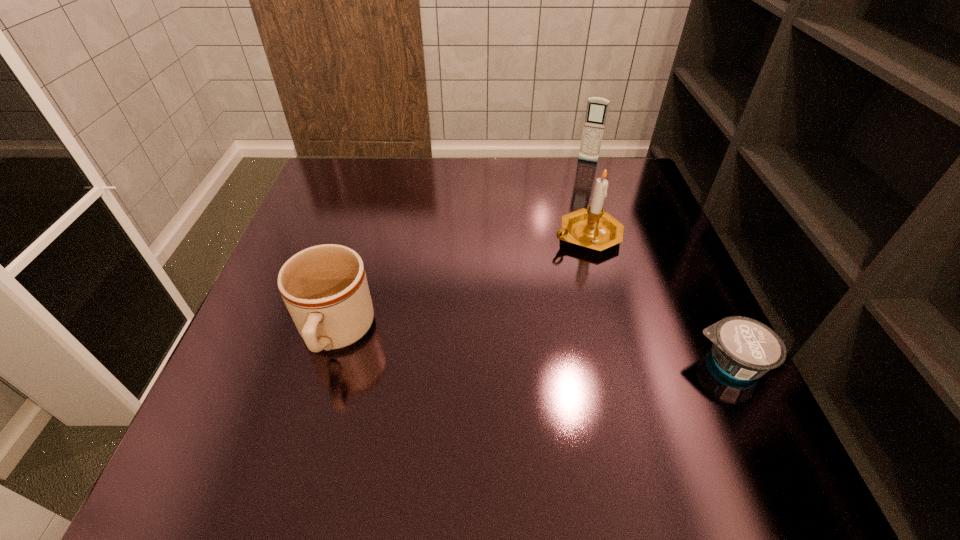
At what (x,y) coordinates should I click in order to perform the action: click on free space on the desktop that is between the second shortest object and the shortest object and is positioned with a handle on the candle holder. Please return your answer as a coordinate pair (x, y). Image resolution: width=960 pixels, height=540 pixels. Looking at the image, I should click on (481, 345).

Locate an element on the screen. This screenshot has width=960, height=540. vacant space on the desktop that is between the third tallest object and the rightmost object and is positioned on the front-facing side of the cellular telephone is located at coordinates (522, 348).